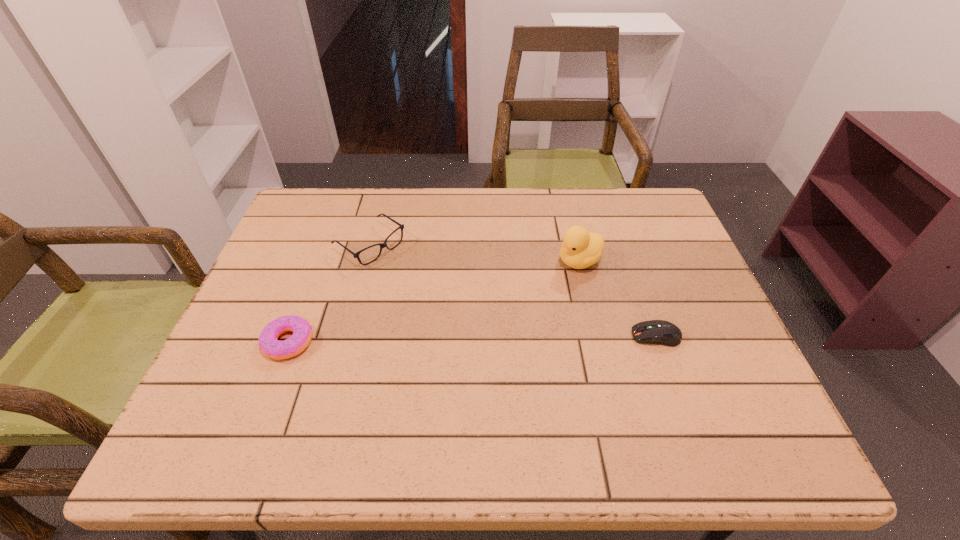
Locate an element on the screen. This screenshot has width=960, height=540. free spot located on the front-facing side of the second tallest object is located at coordinates (423, 282).

Identify the location of free space located on the front-facing side of the second tallest object. (423, 282).

This screenshot has width=960, height=540. Identify the location of free space located on the front-facing side of the third object from left to right. (503, 301).

Find the location of a particular element. This screenshot has width=960, height=540. vacant space positioned on the front-facing side of the third object from left to right is located at coordinates (531, 286).

Where is `vacant space located 0.290m on the front-facing side of the third object from left to right`? The image size is (960, 540). vacant space located 0.290m on the front-facing side of the third object from left to right is located at coordinates (472, 318).

This screenshot has width=960, height=540. What are the coordinates of `object positioned at the far edge` in the screenshot? It's located at (382, 245).

Identify the location of doughnut positioned at the left edge. (302, 331).

The width and height of the screenshot is (960, 540). In order to click on spectacles present at the left edge in this screenshot , I will do `click(382, 245)`.

The image size is (960, 540). What are the coordinates of `object that is at the right edge` in the screenshot? It's located at (x=661, y=332).

Find the location of a particular element. The height and width of the screenshot is (540, 960). object at the far left corner is located at coordinates tap(382, 245).